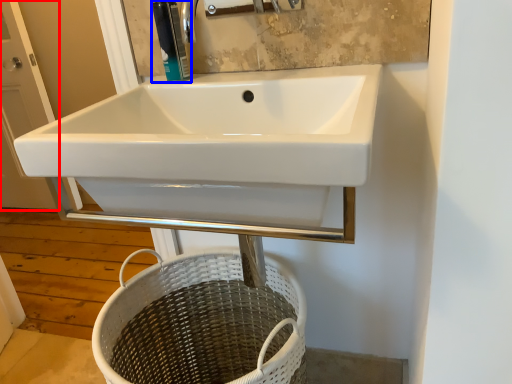
Question: Among these objects, which one is farthest to the camera, screen door (highlighted by a red box) or soap dispenser (highlighted by a blue box)?

Choices:
 (A) screen door
 (B) soap dispenser

Answer: (A)